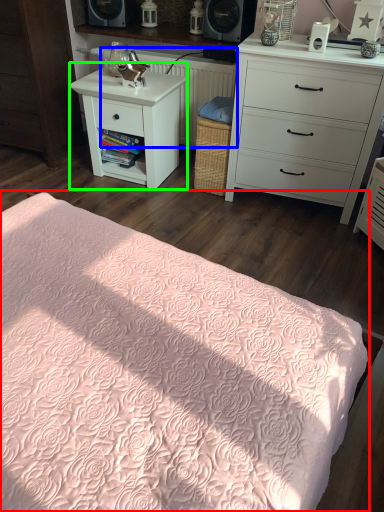
Question: Based on their relative distances, which object is farther from bed (highlighted by a red box)? Choose from radiator (highlighted by a blue box) and nightstand (highlighted by a green box).

Choices:
 (A) radiator
 (B) nightstand

Answer: (A)